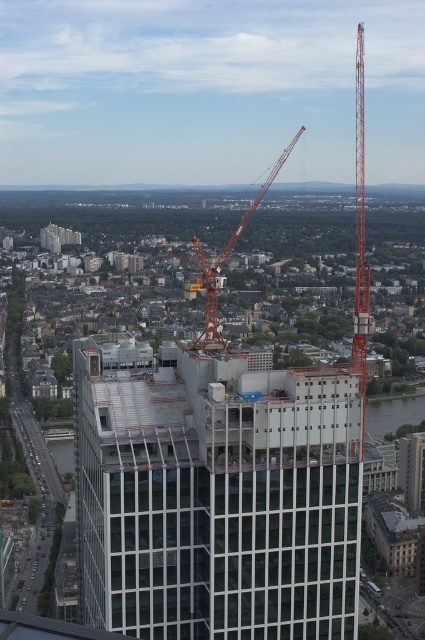
Does clear glass building at center have a larger size compared to orange metallic crane at center?

No.

Which is more to the right, clear glass building at center or orange metallic crane at center?

From the viewer's perspective, orange metallic crane at center appears more on the right side.

Describe the element at coordinates (218, 499) in the screenshot. I see `clear glass building at center` at that location.

The width and height of the screenshot is (425, 640). What are the coordinates of `clear glass building at center` in the screenshot? It's located at (218, 499).